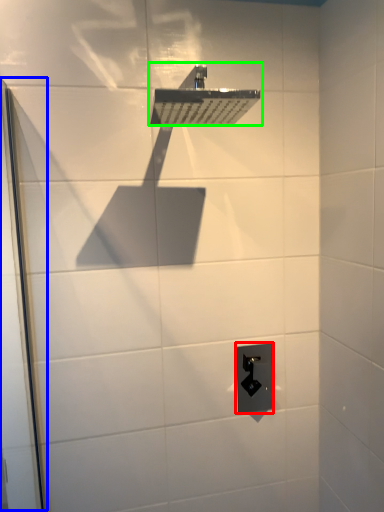
Question: Estimate the real-world distances between objects in this image. Which object is farther from electric outlet (highlighted by a red box), screen door (highlighted by a blue box) or shower (highlighted by a green box)?

Choices:
 (A) screen door
 (B) shower

Answer: (B)